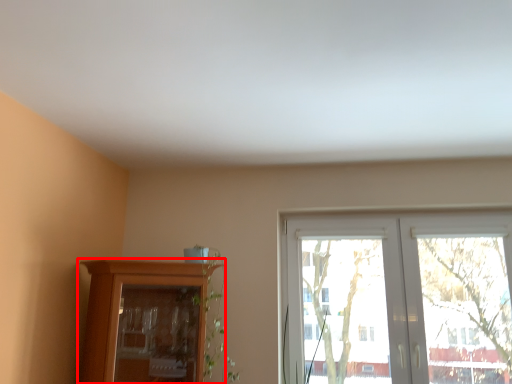
Question: From the image, what is the correct spatial relationship of cupboard (annotated by the red box) in relation to window?

Choices:
 (A) right
 (B) left

Answer: (B)